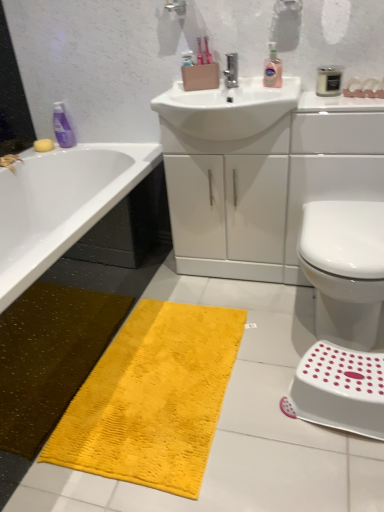
Where is `vacant space that is to the left of pink glossy liquid soap at upper center`? vacant space that is to the left of pink glossy liquid soap at upper center is located at coordinates click(251, 87).